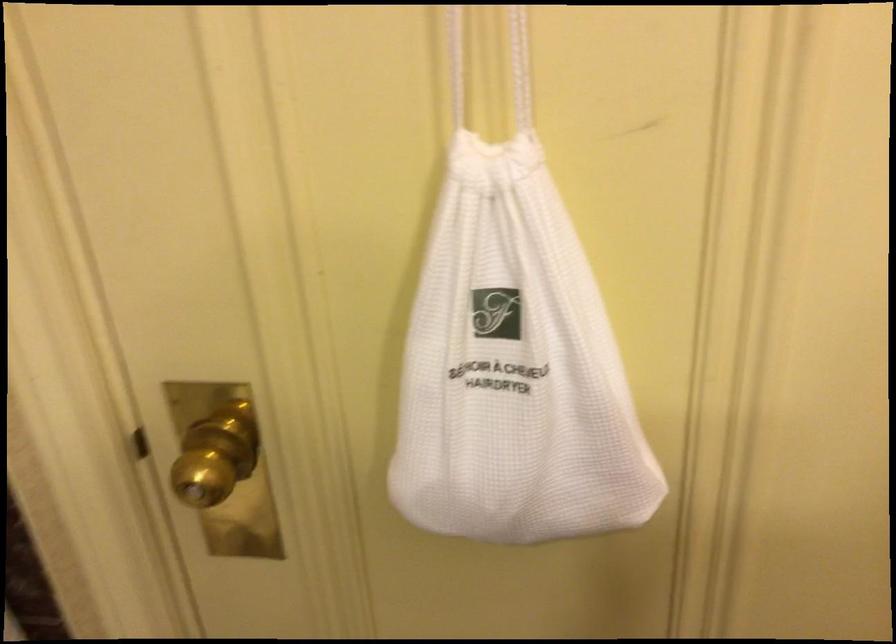
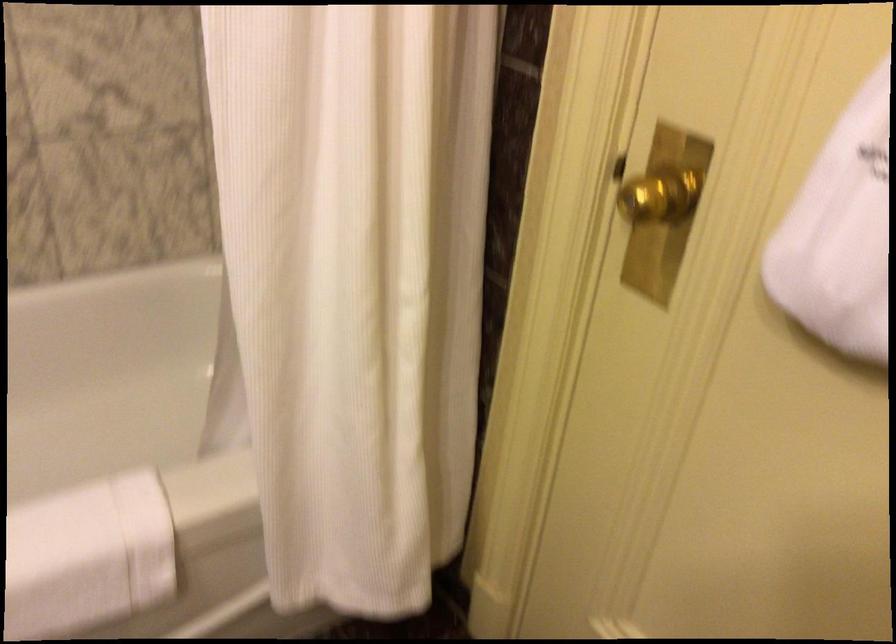
Question: The camera is either moving clockwise (left) or counter-clockwise (right) around the object. The first image is from the beginning of the video and the second image is from the end. Is the camera moving left or right when shooting the video?

Choices:
 (A) Left
 (B) Right

Answer: (B)